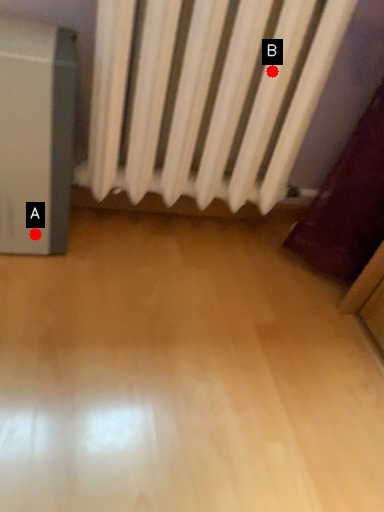
Question: Two points are circled on the image, labeled by A and B beside each circle. Among these points, which one is farthest from the camera?

Choices:
 (A) A is further
 (B) B is further

Answer: (A)